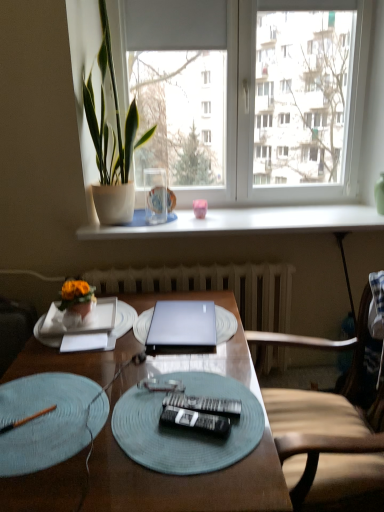
What are the coordinates of `free space between light blue textured placemat at lower left and white paper at center` in the screenshot? It's located at (62, 360).